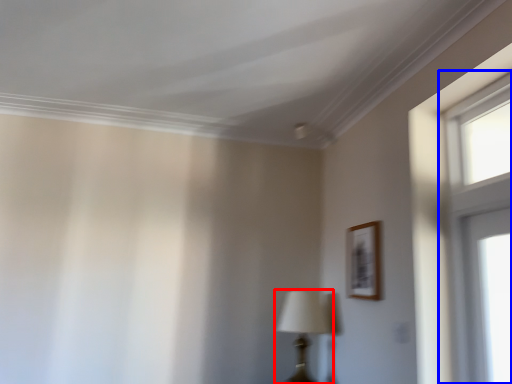
Question: Among these objects, which one is nearest to the camera, table lamp (highlighted by a red box) or window (highlighted by a blue box)?

Choices:
 (A) table lamp
 (B) window

Answer: (B)